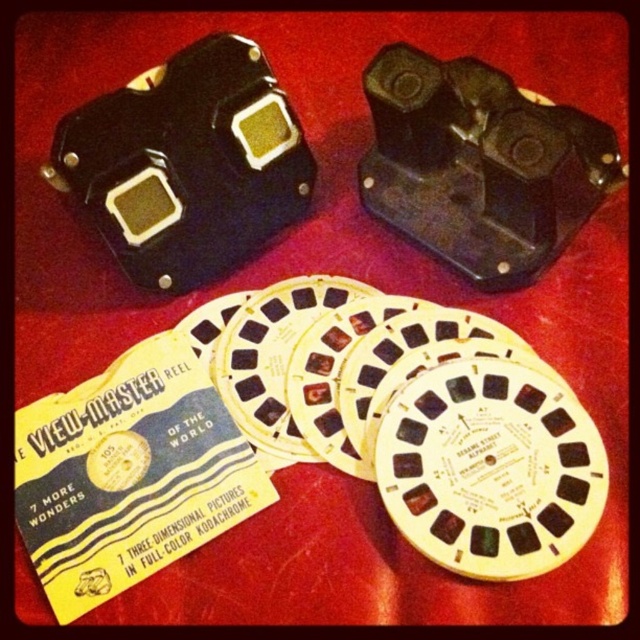
Identify the location of black plastic camera at upper left. (188, 164).

Who is more distant from viewer, (179, 161) or (595, 186)?

The point (179, 161) is behind.

Locate an element on the screen. The width and height of the screenshot is (640, 640). black plastic camera at upper left is located at coordinates (188, 164).

Is point (248, 467) positioned after point (433, 115)?

No, (248, 467) is closer to viewer.

Does yellow paper card at upper left appear on the left side of black plastic camera at upper center?

Indeed, yellow paper card at upper left is positioned on the left side of black plastic camera at upper center.

Is point (208, 461) positioned behind point (416, 236)?

No, (208, 461) is closer to viewer.

This screenshot has height=640, width=640. What are the coordinates of `yellow paper card at upper left` in the screenshot? It's located at (129, 474).

Does point (54, 584) come behind point (204, 260)?

That is False.

Who is higher up, yellow paper card at upper left or black plastic camera at upper left?

black plastic camera at upper left is above.

Locate an element on the screen. Image resolution: width=640 pixels, height=640 pixels. yellow paper card at upper left is located at coordinates (129, 474).

Locate an element on the screen. yellow paper card at upper left is located at coordinates (129, 474).